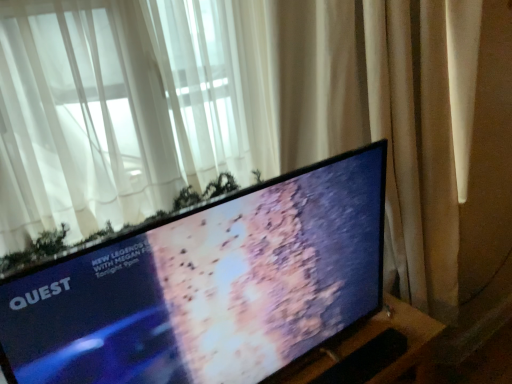
Question: Choose the correct answer: Is beige fabric curtain at right, the second curtain in the left-to-right sequence, inside matte black tv at center or outside it?

Choices:
 (A) outside
 (B) inside

Answer: (A)

Question: From a real-world perspective, is beige fabric curtain at right, the second curtain in the left-to-right sequence, above or below matte black tv at center?

Choices:
 (A) above
 (B) below

Answer: (B)

Question: Which object is positioned closest to the beige fabric curtain at right, which is the 1th curtain in right-to-left order?

Choices:
 (A) white sheer curtain at upper left, the 2th curtain viewed from the right
 (B) black matte keyboard at lower center
 (C) matte black tv at center

Answer: (C)

Question: Based on their relative distances, which object is nearer to the matte black tv at center?

Choices:
 (A) black matte keyboard at lower center
 (B) beige fabric curtain at right, the second curtain in the left-to-right sequence
 (C) white sheer curtain at upper left, the 2th curtain viewed from the right

Answer: (A)